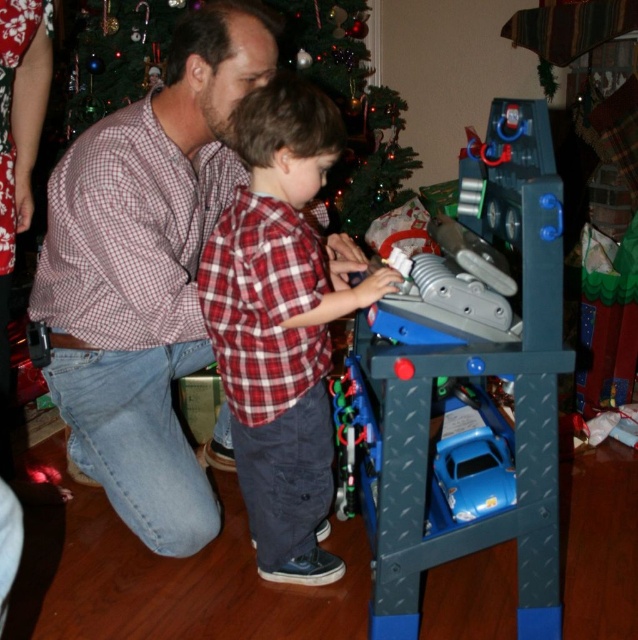
Can you confirm if checkered shirt at center is positioned above red plaid shirt at center?

Yes, checkered shirt at center is above red plaid shirt at center.

Between checkered shirt at center and red plaid shirt at center, which one has less height?

Standing shorter between the two is red plaid shirt at center.

Is point (170, 404) closer to viewer compared to point (313, 252)?

That is False.

You are a GUI agent. You are given a task and a screenshot of the screen. Output one action in this format:
    pyautogui.click(x=<x>, y=<y>)
    Task: Click on the checkered shirt at center
    The image size is (638, 640).
    Given the screenshot: What is the action you would take?
    pyautogui.click(x=145, y=273)

Is blue plastic toy at center further to camera compared to blue plastic car at lower center?

No, it is in front of blue plastic car at lower center.

Does blue plastic toy at center appear under blue plastic car at lower center?

No, blue plastic toy at center is not below blue plastic car at lower center.

Who is more forward, [385,632] or [461,451]?

Point [385,632]

Identify the location of blue plastic toy at center. The height and width of the screenshot is (640, 638). (475, 378).

Which is below, checkered shirt at center or blue plastic car at lower center?

blue plastic car at lower center is below.

Between checkered shirt at center and blue plastic car at lower center, which one appears on the right side from the viewer's perspective?

Positioned to the right is blue plastic car at lower center.

Is point (209, 52) closer to camera compared to point (470, 444)?

That is True.

Where is `checkered shirt at center`? The width and height of the screenshot is (638, 640). checkered shirt at center is located at coordinates (145, 273).